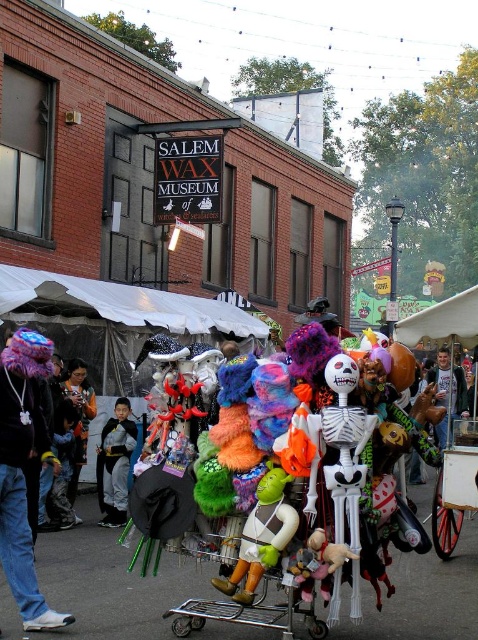
Question: In this image, where is fuzzy purple hat at left located relative to metallic silver shopping cart at center?

Choices:
 (A) above
 (B) below

Answer: (A)

Question: Among these points, which one is nearest to the camera?

Choices:
 (A) (51, 611)
 (B) (112, 525)

Answer: (A)

Question: Which point is closer to the camera?

Choices:
 (A) multicolored plush toy at center
 (B) metallic silver shopping cart at center
 (C) fuzzy purple hat at left
 (D) matte black jacket at center

Answer: (B)

Question: Is fuzzy purple hat at left closer to the viewer compared to black fabric costume at center?

Choices:
 (A) yes
 (B) no

Answer: (A)

Question: Which object appears closest to the camera in this image?

Choices:
 (A) multicolored plush toy at center
 (B) green rubber shrek at center
 (C) black fabric costume at center

Answer: (B)

Question: Observing the image, what is the correct spatial positioning of black fabric costume at center in reference to multicolored plush toy at center?

Choices:
 (A) left
 (B) right

Answer: (B)